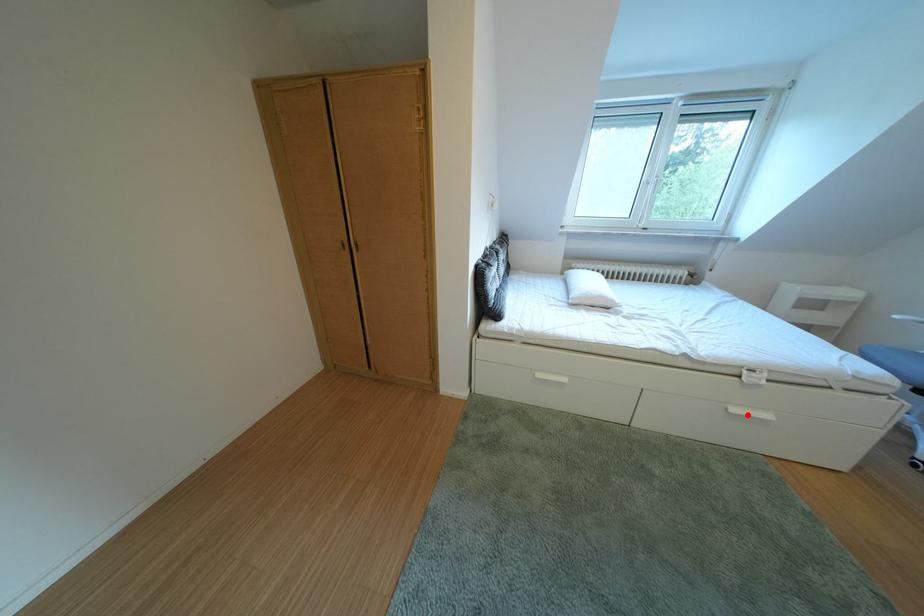
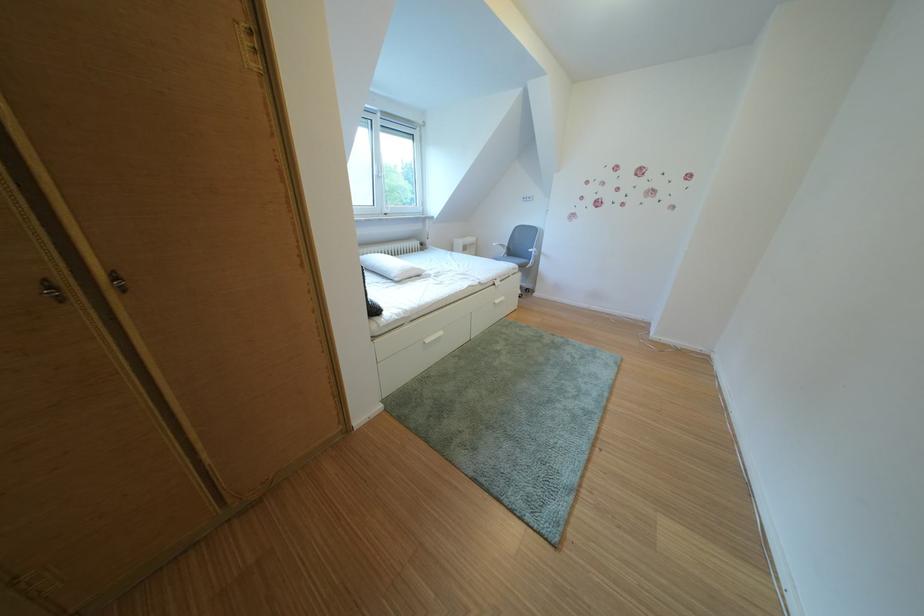
Find the pixel in the second image that matches the highlighted location in the first image.

(511, 307)